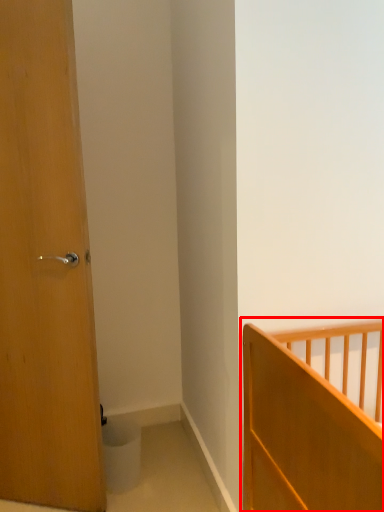
Question: Observing the image, what is the correct spatial positioning of bed (annotated by the red box) in reference to door?

Choices:
 (A) right
 (B) left

Answer: (A)